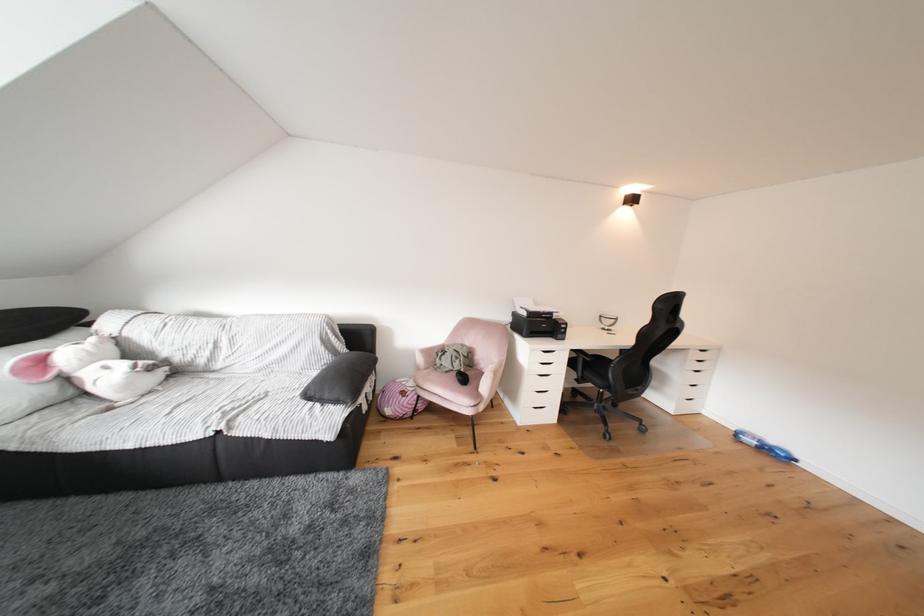
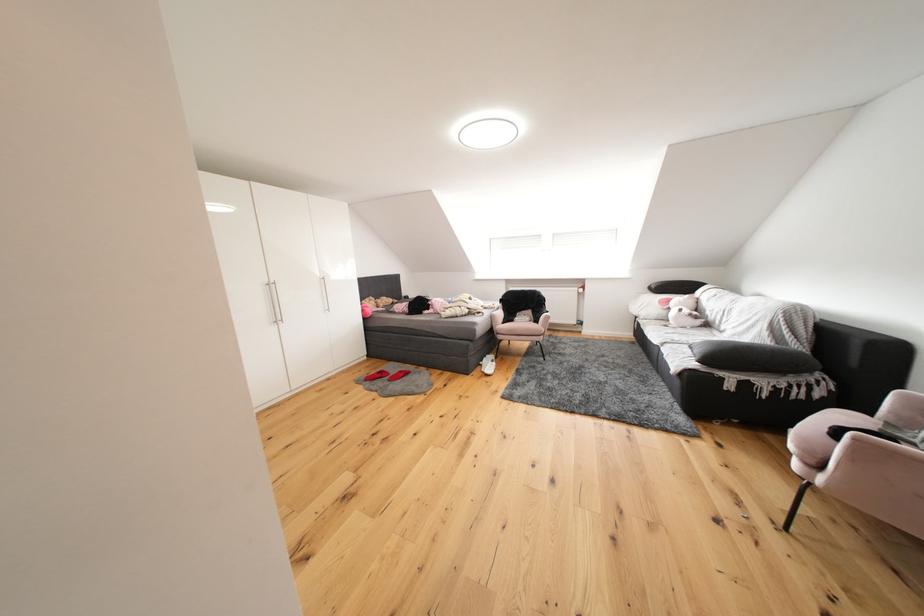
Find the pixel in the second image that matches the point at 50,363 in the first image.

(677, 305)